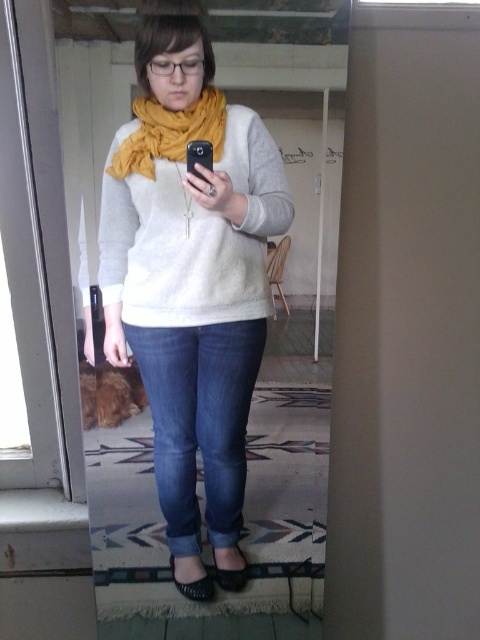
Consider the image. You are a photographer trying to frame a shot of the fuzzy white sweater at center and the leather at lower center. If your camera can only focus on objects within 20 inches of each other, will both items be in focus?

The fuzzy white sweater at center and leather at lower center are 25.70 inches apart, which exceeds the 20 inches focus range, so they cannot both be in focus at the same time.

You are a photographer trying to capture the person in the image. If you want to focus on the fuzzy white sweater at center without the leather at lower center being visible, where should you position your camera?

Position the camera so that it only captures the fuzzy white sweater at center, which is in front of the leather at lower center, thereby blocking the view of the leather.